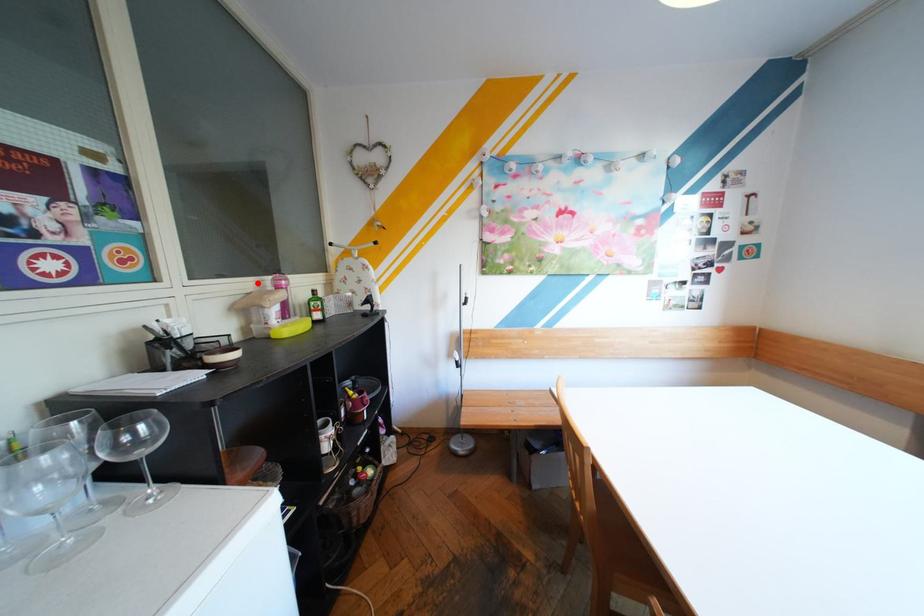
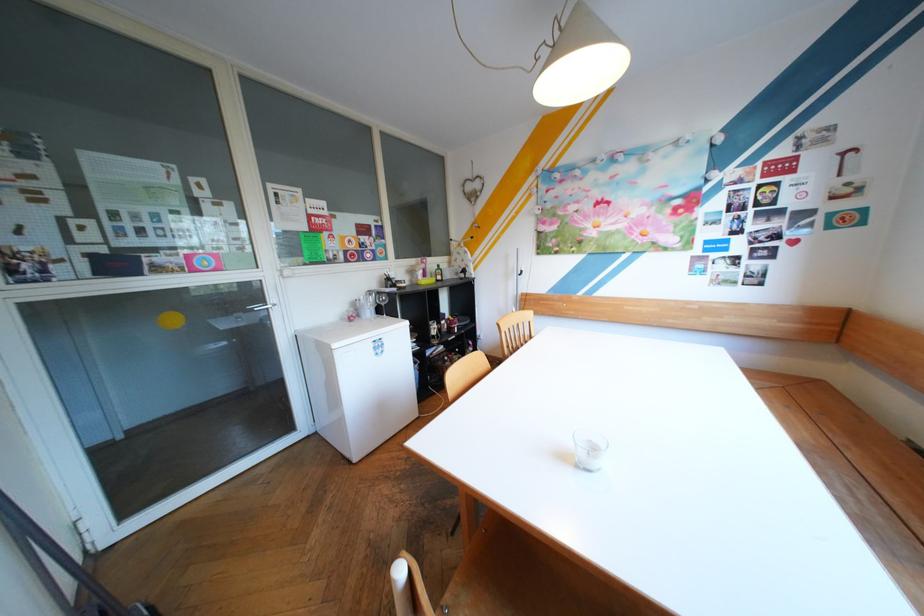
Find the pixel in the second image that matches the highlighted location in the first image.

(426, 261)